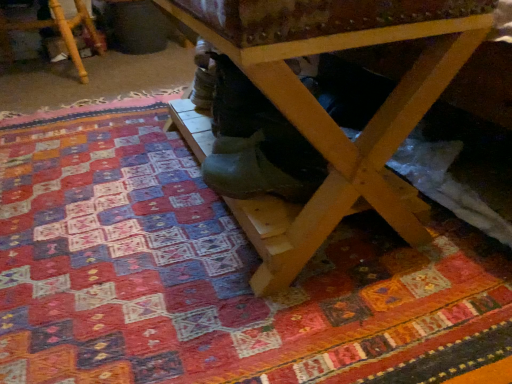
What is the approximate width of green rubber boot at center?

7.66 inches.

Find the location of a particular element. wooden stool at lower left is located at coordinates (55, 28).

What do you see at coordinates (55, 28) in the screenshot? The width and height of the screenshot is (512, 384). I see `wooden stool at lower left` at bounding box center [55, 28].

I want to click on green rubber boot at center, so click(264, 166).

Is green rubber boot at center completely or partially inside wooden table at center?

Yes, green rubber boot at center is a part of wooden table at center.

Is wooden table at center shorter than green rubber boot at center?

No.

Is wooden table at center facing towards green rubber boot at center?

Yes.

Consider the image. Is wooden table at center taller or shorter than wooden stool at lower left?

wooden table at center is taller than wooden stool at lower left.

Considering the relative sizes of wooden table at center and wooden stool at lower left in the image provided, is wooden table at center smaller than wooden stool at lower left?

Incorrect, wooden table at center is not smaller in size than wooden stool at lower left.

In the scene shown: Is wooden table at center turned away from wooden stool at lower left?

No, wooden table at center is not facing the opposite direction of wooden stool at lower left.

How many degrees apart are the facing directions of wooden table at center and wooden stool at lower left?

99.3 degrees separate the facing orientations of wooden table at center and wooden stool at lower left.

Considering the sizes of green rubber boot at center and wooden table at center in the image, is green rubber boot at center bigger or smaller than wooden table at center?

green rubber boot at center is smaller than wooden table at center.

Does green rubber boot at center appear on the left side of wooden table at center?

Correct, you'll find green rubber boot at center to the left of wooden table at center.

Is point (288, 171) less distant than point (366, 205)?

Yes, point (288, 171) is closer to viewer.

Is wooden table at center a part of green rubber boot at center?

No, wooden table at center is not surrounded by green rubber boot at center.

Could you tell me if wooden stool at lower left is facing green rubber boot at center?

No, wooden stool at lower left is not aimed at green rubber boot at center.

Considering the sizes of wooden stool at lower left and green rubber boot at center in the image, is wooden stool at lower left bigger or smaller than green rubber boot at center?

Clearly, wooden stool at lower left is larger in size than green rubber boot at center.

Between wooden stool at lower left and green rubber boot at center, which one has larger width?

With larger width is wooden stool at lower left.

From the image's perspective, would you say wooden stool at lower left is shown under green rubber boot at center?

No, from the image's perspective, wooden stool at lower left is not below green rubber boot at center.

Could you tell me if green rubber boot at center is facing wooden stool at lower left?

No, green rubber boot at center is not oriented towards wooden stool at lower left.

What's the angular difference between green rubber boot at center and wooden stool at lower left's facing directions?

green rubber boot at center and wooden stool at lower left are facing 74.8 degrees away from each other.

Which of these two, green rubber boot at center or wooden stool at lower left, is smaller?

With smaller size is green rubber boot at center.

Between wooden stool at lower left and wooden table at center, which one is positioned behind?

wooden stool at lower left.

Is wooden stool at lower left with wooden table at center?

No, wooden stool at lower left is not touching wooden table at center.

Find the location of a particular element. table on the right of wooden stool at lower left is located at coordinates (333, 120).

Is wooden stool at lower left bigger than wooden table at center?

No, wooden stool at lower left is not bigger than wooden table at center.

The width and height of the screenshot is (512, 384). What are the coordinates of `shoe located below the wooden table at center (from the image's perspective)` in the screenshot? It's located at (264, 166).

Find the location of a particular element. The height and width of the screenshot is (384, 512). furniture beneath the wooden table at center (from a real-world perspective) is located at coordinates (55, 28).

Which object lies nearer to the anchor point wooden stool at lower left, green rubber boot at center or wooden table at center?

The object closer to wooden stool at lower left is green rubber boot at center.

Looking at the image, which one is located closer to green rubber boot at center, wooden table at center or wooden stool at lower left?

wooden table at center.

Looking at the image, which one is located further to wooden stool at lower left, wooden table at center or green rubber boot at center?

wooden table at center is positioned further to the anchor wooden stool at lower left.

Which object lies further to the anchor point wooden table at center, wooden stool at lower left or green rubber boot at center?

wooden stool at lower left lies further to wooden table at center than the other object.

Which object lies further to the anchor point green rubber boot at center, wooden stool at lower left or wooden table at center?

Among the two, wooden stool at lower left is located further to green rubber boot at center.

Looking at the image, which one is located further to wooden table at center, green rubber boot at center or wooden stool at lower left?

wooden stool at lower left.

The height and width of the screenshot is (384, 512). Identify the location of shoe located between wooden stool at lower left and wooden table at center in the left-right direction. (264, 166).